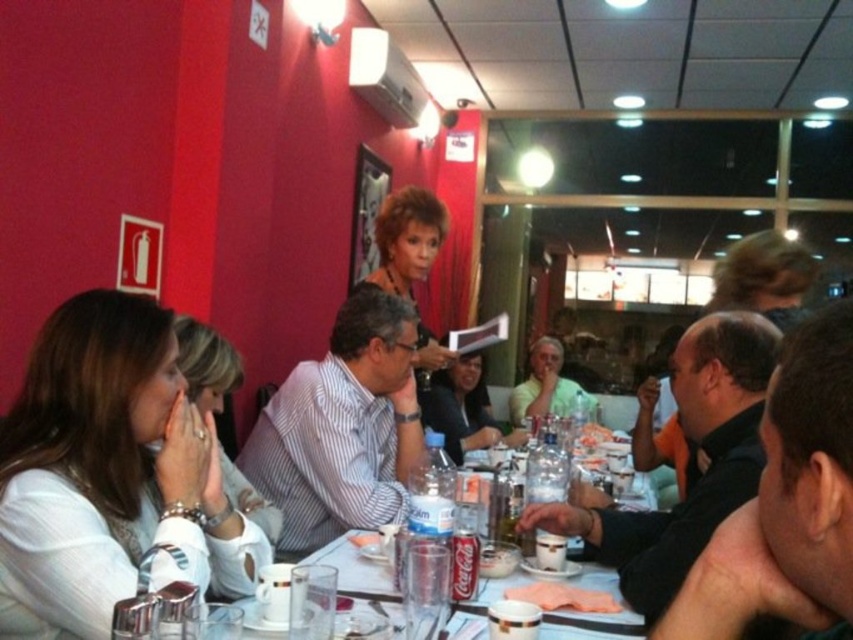
Does white matte shirt at left have a greater height compared to white striped shirt at center?

No, white matte shirt at left is not taller than white striped shirt at center.

Based on the photo, is white matte shirt at left positioned before white striped shirt at center?

Yes.

Is point (216, 556) farther from camera compared to point (350, 454)?

No, (216, 556) is closer to viewer.

Identify the location of white matte shirt at left. This screenshot has width=853, height=640. (109, 474).

Who is lower down, white matte shirt at left or black glossy shirt at center?

black glossy shirt at center is below.

Between white matte shirt at left and black glossy shirt at center, which one appears on the left side from the viewer's perspective?

white matte shirt at left

Who is more distant from viewer, (206,464) or (722,422)?

Point (722,422)

At what (x,y) coordinates should I click in order to perform the action: click on white matte shirt at left. Please return your answer as a coordinate pair (x, y). This screenshot has width=853, height=640. Looking at the image, I should click on coord(109,474).

Who is shorter, white striped shirt at center or light green shirt at center?

With less height is light green shirt at center.

Who is more forward, (360, 301) or (548, 349)?

Positioned in front is point (360, 301).

Locate an element on the screen. The width and height of the screenshot is (853, 640). white striped shirt at center is located at coordinates (341, 428).